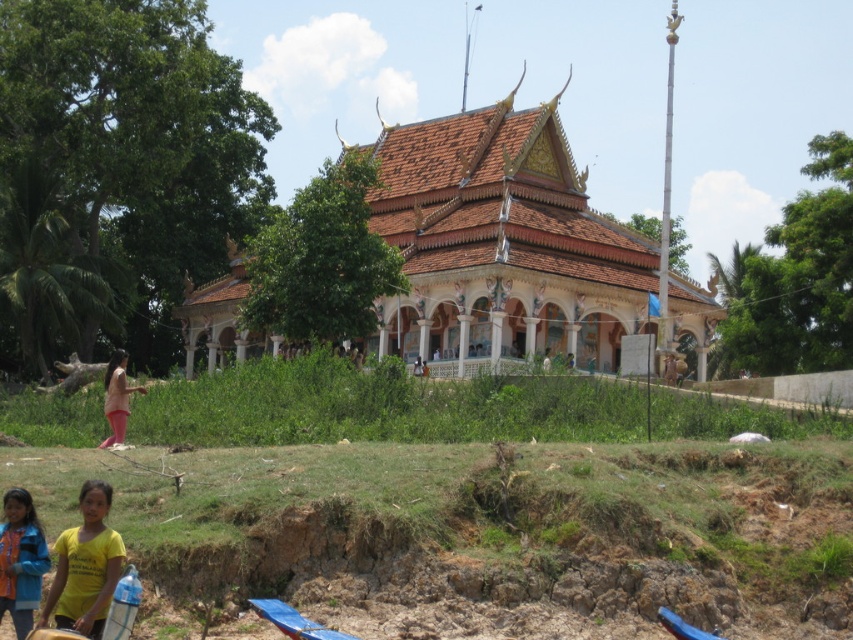
Question: Does pink fabric pants at lower left appear under white fabric person at center?

Choices:
 (A) yes
 (B) no

Answer: (A)

Question: Is yellow matte shirt at lower left to the right of white fabric person at center from the viewer's perspective?

Choices:
 (A) no
 (B) yes

Answer: (A)

Question: Which point is farther from the camera taking this photo?

Choices:
 (A) (665, 371)
 (B) (544, 349)
 (C) (33, 560)

Answer: (B)

Question: Does yellow fabric shirt at lower left appear over brown fabric person at center?

Choices:
 (A) yes
 (B) no

Answer: (B)

Question: Which object is the closest to the brown tiled roof at center?

Choices:
 (A) yellow fabric shirt at lower left
 (B) yellow matte shirt at lower left
 (C) white fabric person at center
 (D) brown fabric person at center

Answer: (C)

Question: Which object is positioned farthest from the yellow matte shirt at lower left?

Choices:
 (A) white fabric person at center
 (B) brown fabric person at center
 (C) brown tiled roof at center
 (D) yellow fabric shirt at lower left

Answer: (C)